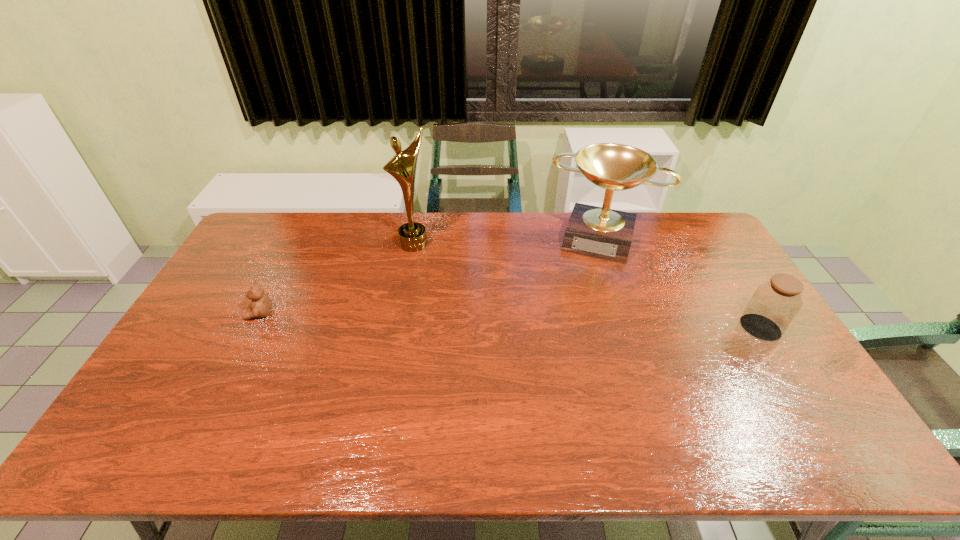
What are the coordinates of `vacant area situated on the face of the leftmost object` in the screenshot? It's located at (217, 314).

What are the coordinates of `free spot located 0.190m on the front of the jar` in the screenshot? It's located at (805, 401).

The height and width of the screenshot is (540, 960). Find the location of `vacant area situated 0.050m on the front-facing side of the third object from right to left`. vacant area situated 0.050m on the front-facing side of the third object from right to left is located at coordinates (431, 259).

Locate an element on the screen. This screenshot has width=960, height=540. free region located on the front-facing side of the third object from right to left is located at coordinates (483, 308).

The width and height of the screenshot is (960, 540). Find the location of `vacant space located 0.110m on the front-facing side of the third object from right to left`. vacant space located 0.110m on the front-facing side of the third object from right to left is located at coordinates (441, 268).

At what (x,y) coordinates should I click in order to perform the action: click on free space located on the front-facing side of the right award. Please return your answer as a coordinate pair (x, y). The height and width of the screenshot is (540, 960). Looking at the image, I should click on (577, 313).

The image size is (960, 540). Find the location of `vacant region located 0.150m on the front-facing side of the right award`. vacant region located 0.150m on the front-facing side of the right award is located at coordinates (583, 292).

This screenshot has width=960, height=540. Find the location of `free space located 0.080m on the front-facing side of the right award`. free space located 0.080m on the front-facing side of the right award is located at coordinates (587, 278).

This screenshot has width=960, height=540. I want to click on object positioned at the left edge, so click(261, 305).

Find the location of `object located at the right edge`. object located at the right edge is located at coordinates (774, 304).